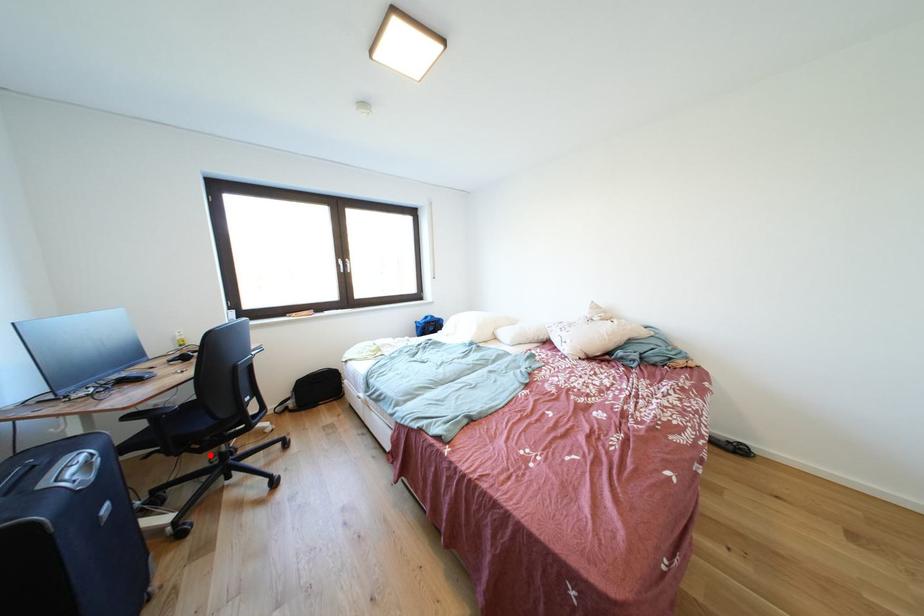
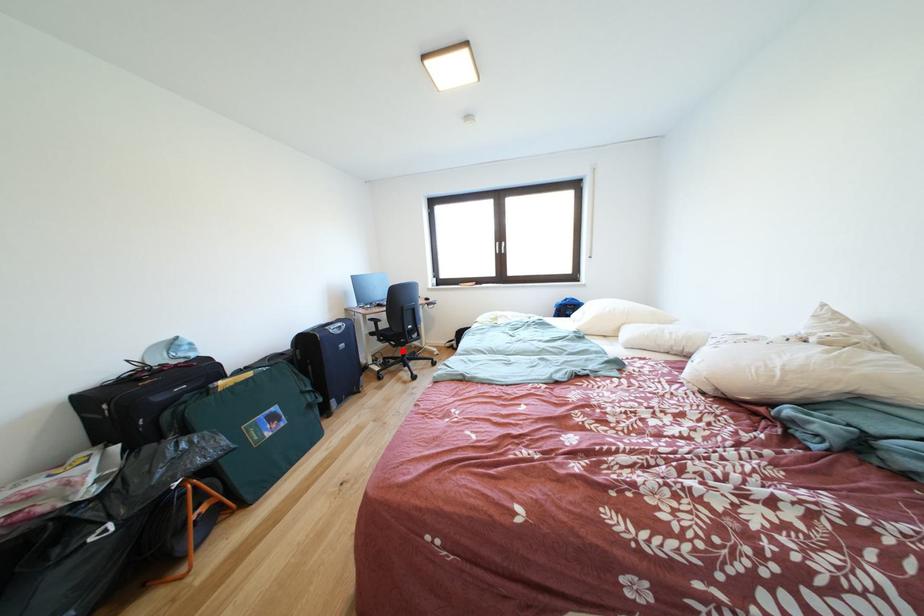
I am providing you with two images of the same scene from different viewpoints. A red point is marked on the first image and another point is marked on the second image. Is the red point in image1 aligned with the point shown in image2?

Yes